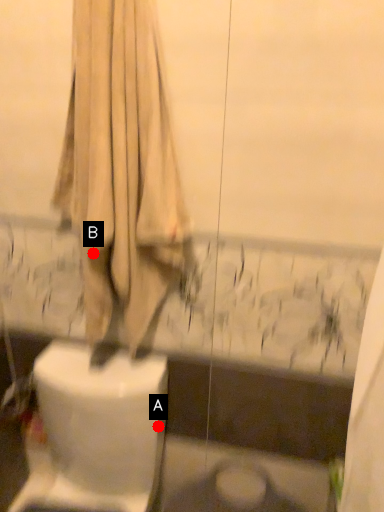
Question: Two points are circled on the image, labeled by A and B beside each circle. Which point appears farthest from the camera in this image?

Choices:
 (A) A is further
 (B) B is further

Answer: (A)